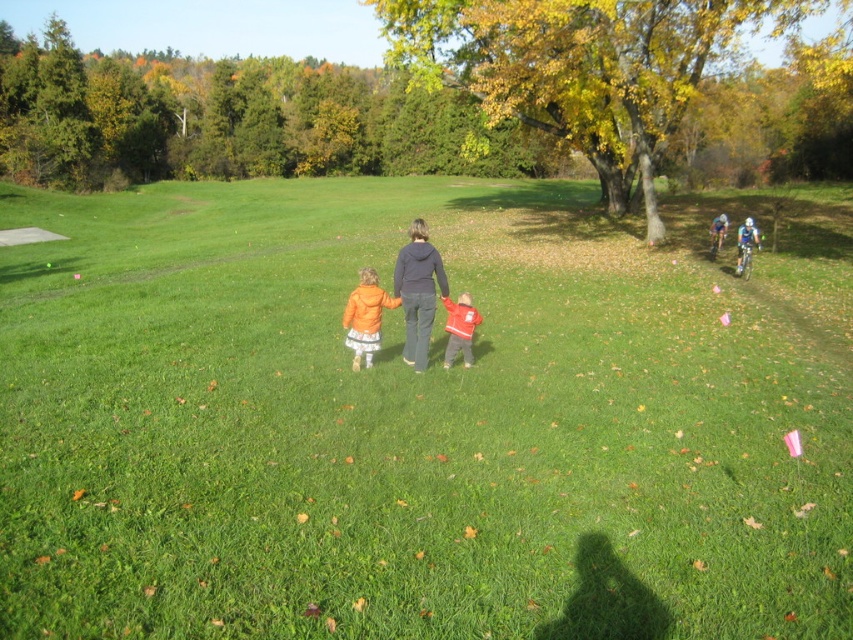
Question: Among these objects, which one is nearest to the camera?

Choices:
 (A) blue fabric cyclist at right
 (B) green grassy field at center
 (C) red fleece jacket at center

Answer: (B)

Question: Among these objects, which one is farthest from the camera?

Choices:
 (A) dark gray hoodie at center
 (B) orange fabric jacket at center
 (C) red fleece jacket at center
 (D) blue fabric bicycle at right

Answer: (D)

Question: Is orange fabric jacket at center further to camera compared to blue fabric bicycle at right?

Choices:
 (A) no
 (B) yes

Answer: (A)

Question: Is green grassy field at center thinner than blue fabric cyclist at right?

Choices:
 (A) no
 (B) yes

Answer: (A)

Question: Which is farther from the dark gray hoodie at center?

Choices:
 (A) green grassy field at center
 (B) orange fabric jacket at center
 (C) red fleece jacket at center
 (D) blue fabric bicycle at right

Answer: (A)

Question: Can you confirm if orange fabric jacket at center is positioned above red fleece jacket at center?

Choices:
 (A) yes
 (B) no

Answer: (A)